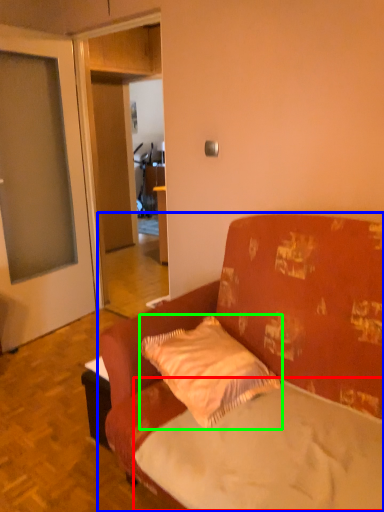
Question: Which object is the farthest from mattress (highlighted by a red box)? Choose among these: studio couch (highlighted by a blue box) or pillow (highlighted by a green box).

Choices:
 (A) studio couch
 (B) pillow

Answer: (B)